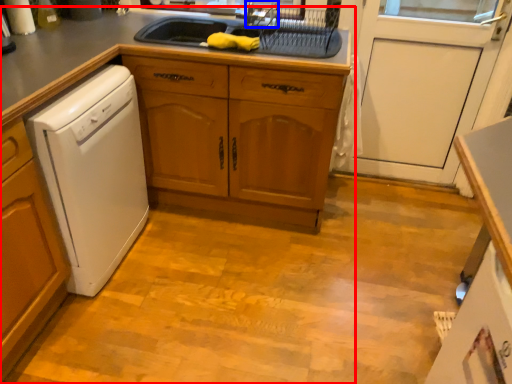
Question: Which of the following is the farthest to the observer, countertop (highlighted by a red box) or faucet (highlighted by a blue box)?

Choices:
 (A) countertop
 (B) faucet

Answer: (B)